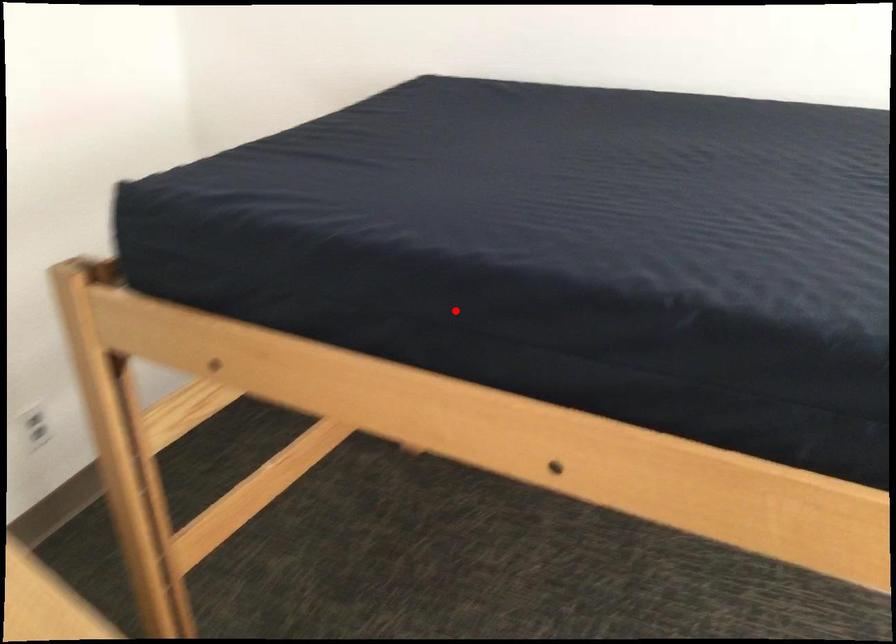
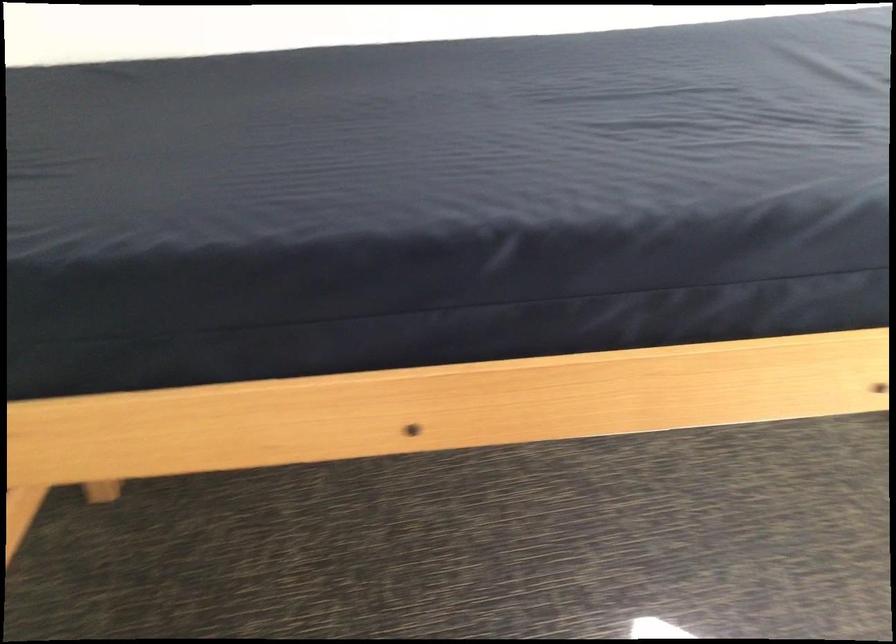
The point at the highlighted location is marked in the first image. Where is the corresponding point in the second image?

(254, 308)